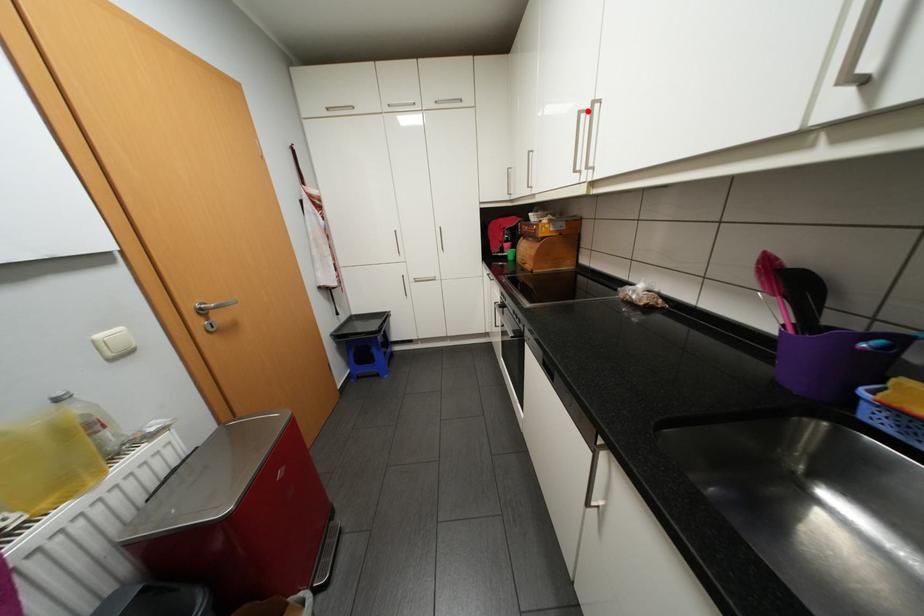
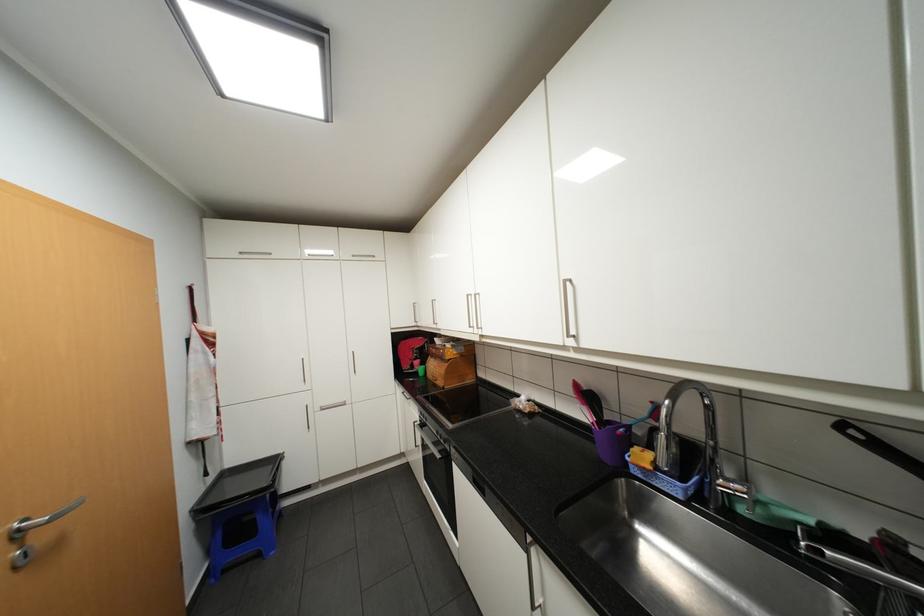
In the second image, find the point that corresponds to the highlighted location in the first image.

(476, 294)